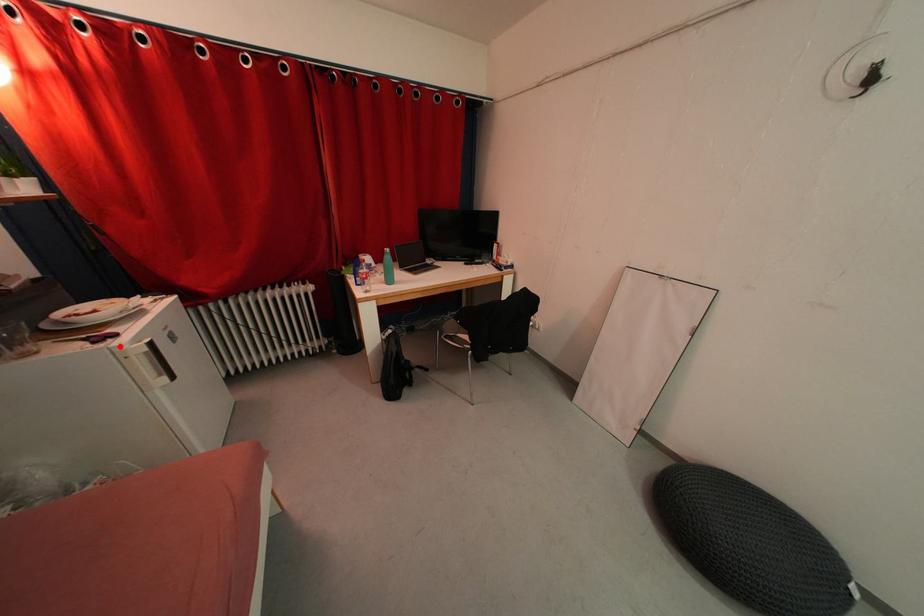
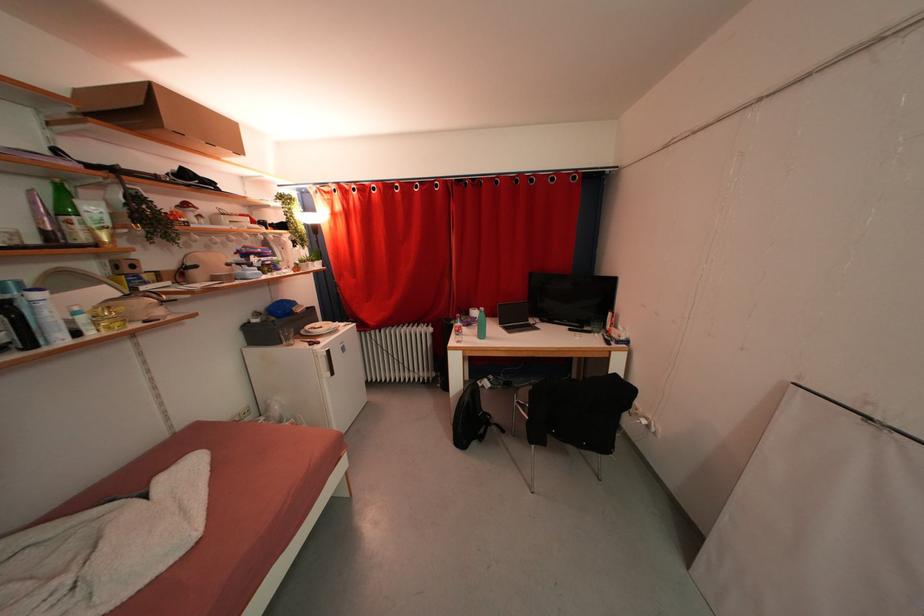
Where in the second image is the point corresponding to the highlighted location from the first image?

(322, 351)